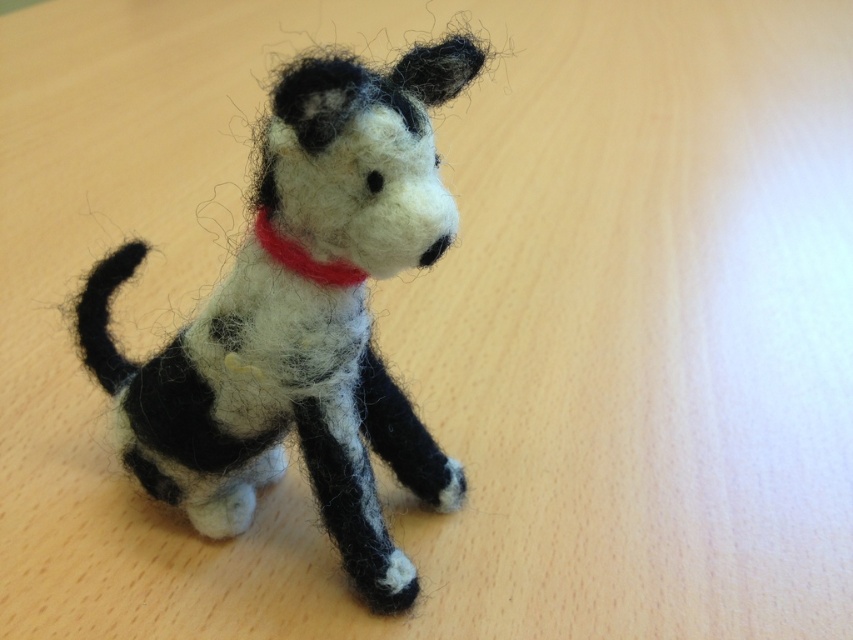
Does point (392, 216) come closer to viewer compared to point (263, 225)?

Yes, point (392, 216) is in front of point (263, 225).

Can you confirm if fuzzy woolen dog at center is positioned to the right of red felt neckband at center?

Incorrect, fuzzy woolen dog at center is not on the right side of red felt neckband at center.

Where is `fuzzy woolen dog at center`? fuzzy woolen dog at center is located at coordinates (x=270, y=410).